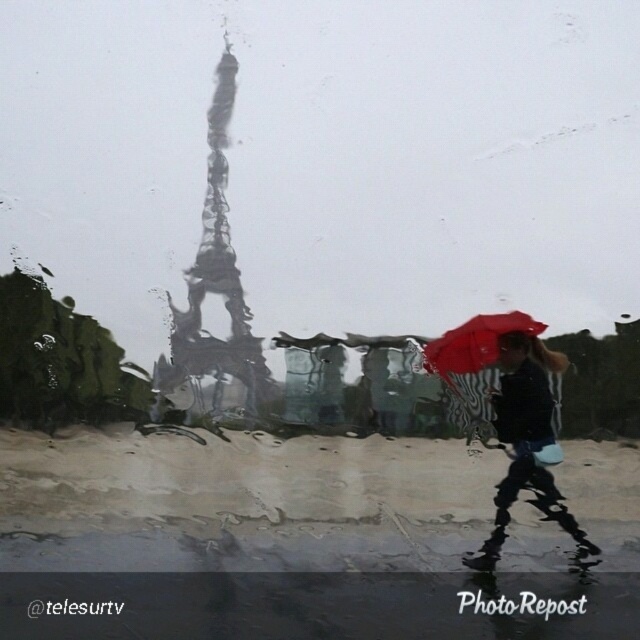
Question: Based on their relative distances, which object is nearer to the matte black umbrella at right?

Choices:
 (A) red matte umbrella at center
 (B) metallic silver eiffel tower at center

Answer: (A)

Question: Which point is closer to the camera?

Choices:
 (A) (499, 321)
 (B) (230, 362)
 (C) (552, 413)

Answer: (C)

Question: Can you confirm if metallic silver eiffel tower at center is wider than matte black umbrella at right?

Choices:
 (A) yes
 (B) no

Answer: (B)

Question: Among these objects, which one is farthest from the camera?

Choices:
 (A) metallic silver eiffel tower at center
 (B) red matte umbrella at center

Answer: (B)

Question: Does metallic silver eiffel tower at center have a larger size compared to red matte umbrella at center?

Choices:
 (A) no
 (B) yes

Answer: (B)

Question: Does metallic silver eiffel tower at center have a smaller size compared to matte black umbrella at right?

Choices:
 (A) no
 (B) yes

Answer: (A)